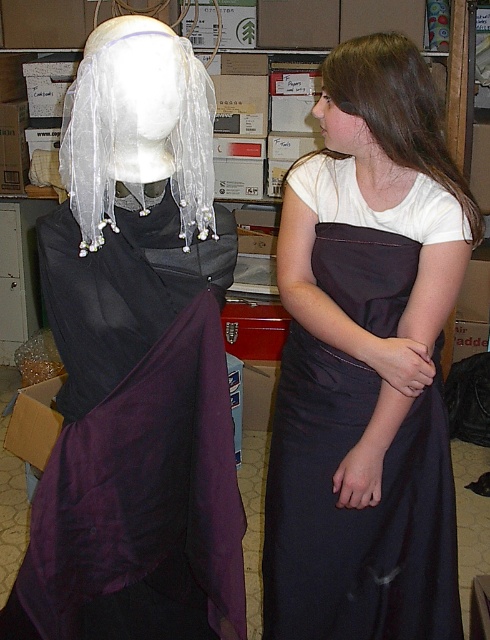
Question: Among these points, which one is farthest from the camera?

Choices:
 (A) (398, 58)
 (B) (98, 412)

Answer: (A)

Question: Does satin dress at center have a greater width compared to purple satin shawl at left?

Choices:
 (A) yes
 (B) no

Answer: (B)

Question: Among these points, which one is nearest to the camera?

Choices:
 (A) (414, 356)
 (B) (356, 77)
 (C) (335, 65)
 (D) (122, 577)

Answer: (D)

Question: Which object is positioned closest to the purple satin shawl at left?

Choices:
 (A) satin dress at center
 (B) brown silky hair at upper right

Answer: (A)

Question: Is satin dress at center wider than brown hair at upper right?

Choices:
 (A) yes
 (B) no

Answer: (A)

Question: Can you confirm if purple satin shawl at left is positioned to the right of brown hair at upper right?

Choices:
 (A) yes
 (B) no

Answer: (B)